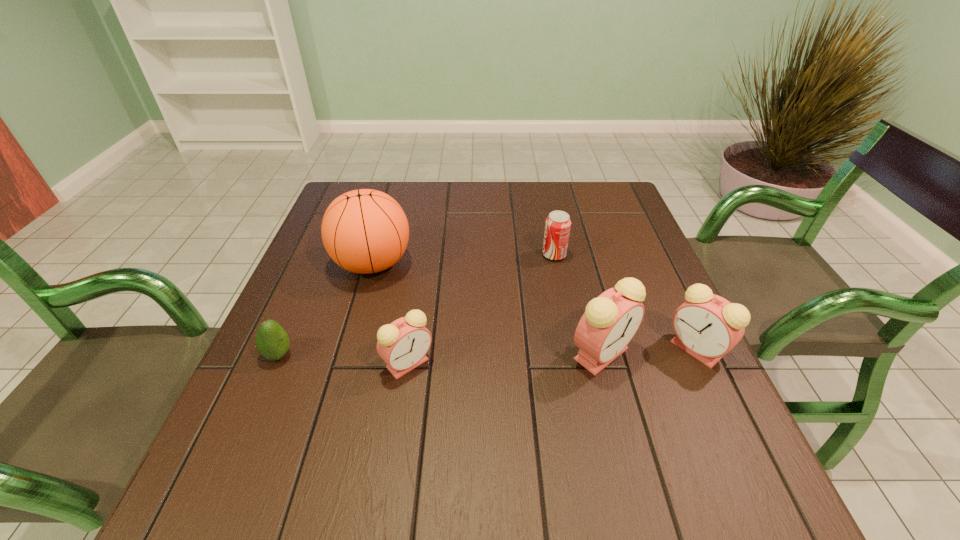
Locate an element on the screen. The image size is (960, 540). vacant area that satisfies the following two spatial constraints: 1. on the logo side of the soda can; 2. on the face of the leftmost alarm clock is located at coordinates (576, 363).